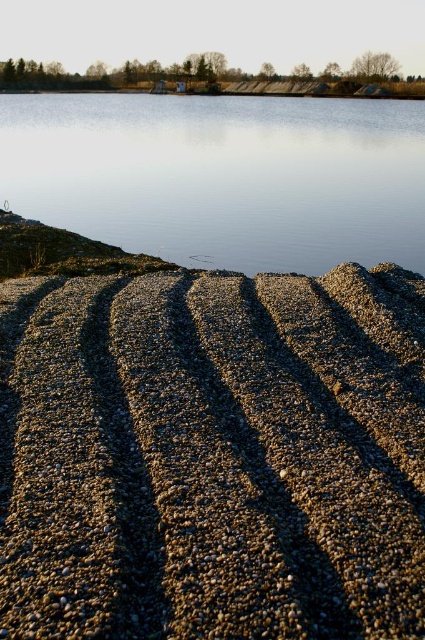
Question: Observing the image, what is the correct spatial positioning of brown pebbled gravel at lower center in reference to clear water at center?

Choices:
 (A) below
 (B) above

Answer: (A)

Question: Can you confirm if brown pebbled gravel at lower center is positioned to the left of clear water at center?

Choices:
 (A) no
 (B) yes

Answer: (B)

Question: Does brown pebbled gravel at lower center appear on the right side of clear water at center?

Choices:
 (A) yes
 (B) no

Answer: (B)

Question: Among these points, which one is farthest from the camera?

Choices:
 (A) (316, 496)
 (B) (231, 260)

Answer: (B)

Question: Which of the following is the closest to the observer?

Choices:
 (A) clear water at center
 (B) brown pebbled gravel at lower center

Answer: (B)